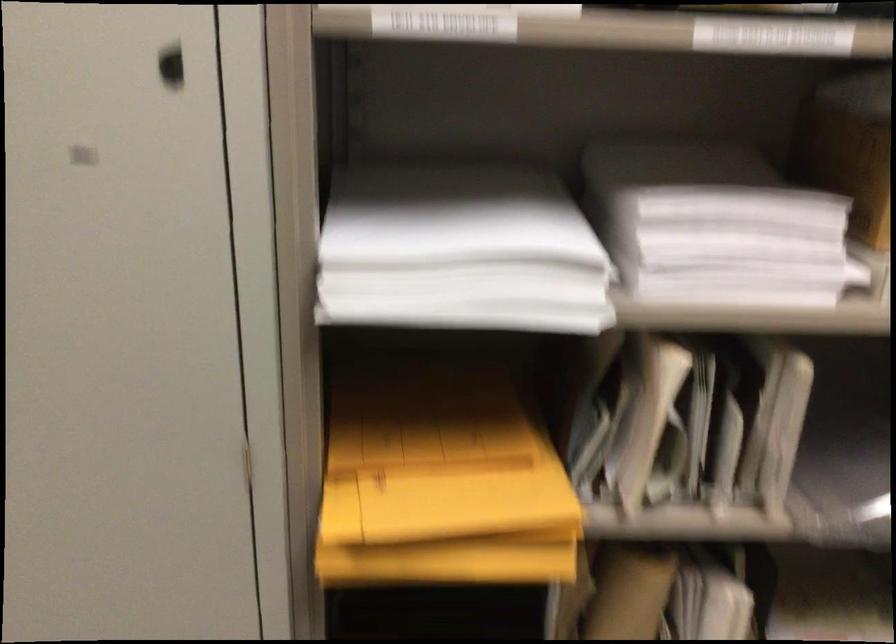
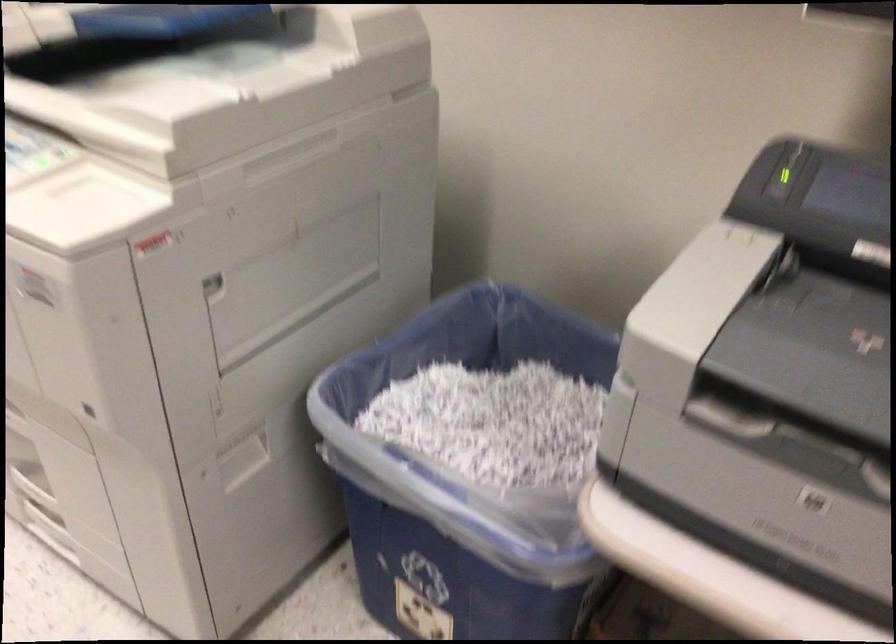
Question: In a continuous first-person perspective shot, in which direction is the camera moving?

Choices:
 (A) Left
 (B) Right
 (C) Forward
 (D) Backward

Answer: (D)